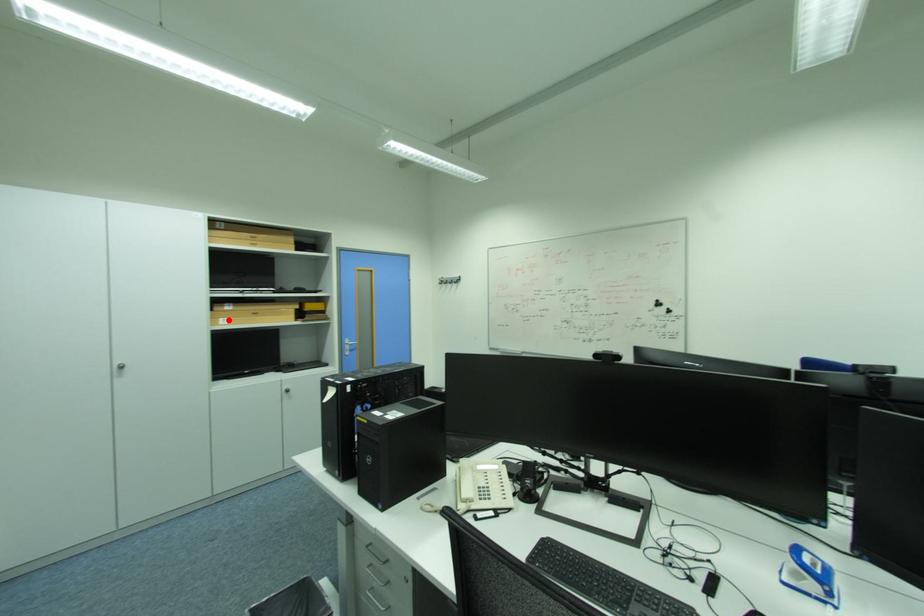
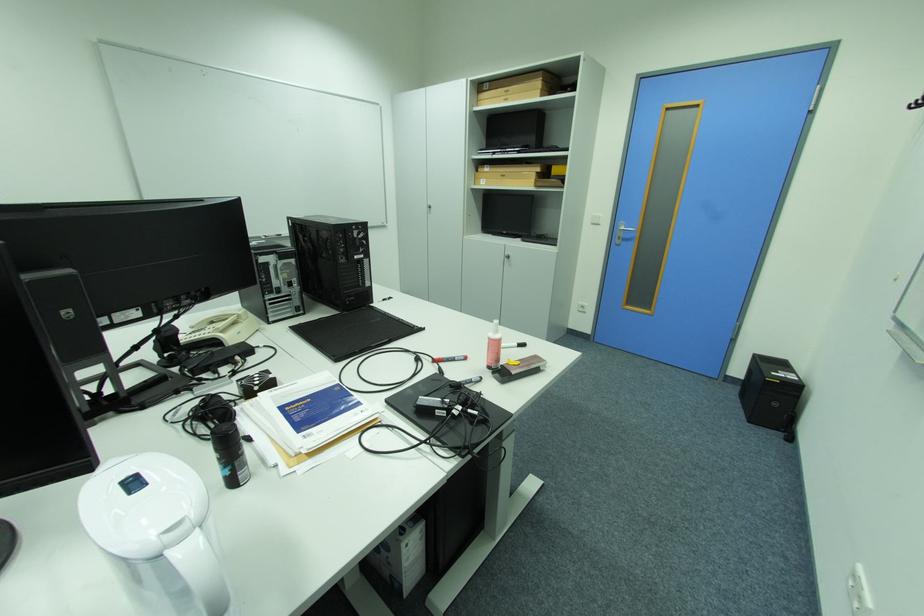
Question: I am providing you with two images of the same scene from different viewpoints. Given a red point in image1, look at the same physical point in image2. Is it:

Choices:
 (A) Closer to the viewpoint
 (B) Farther from the viewpoint

Answer: (A)